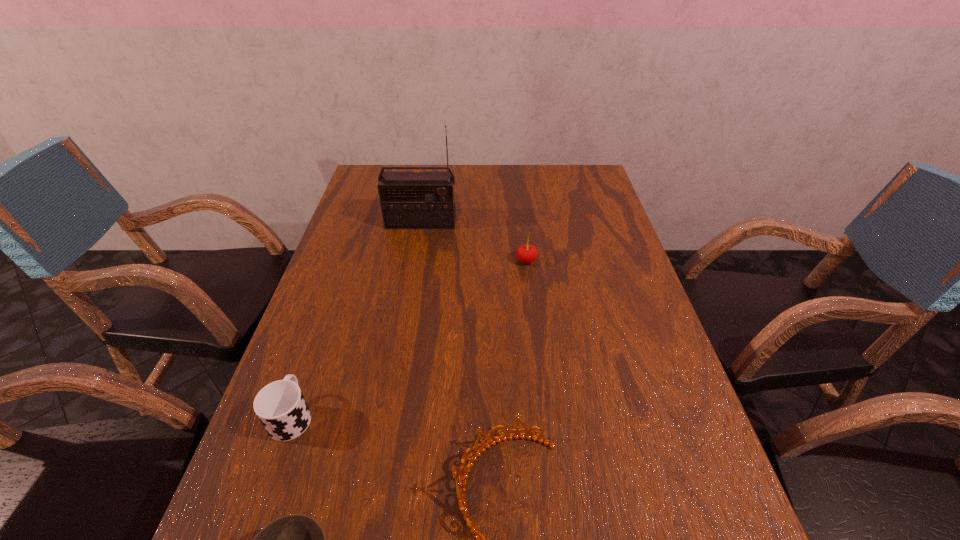
Where is `the fourth closest object to the tiara`? This screenshot has height=540, width=960. the fourth closest object to the tiara is located at coordinates (409, 200).

Find the location of a particular element. free point that satisfies the following two spatial constraints: 1. on the front panel of the second farthest object; 2. on the right side of the farthest object is located at coordinates (414, 261).